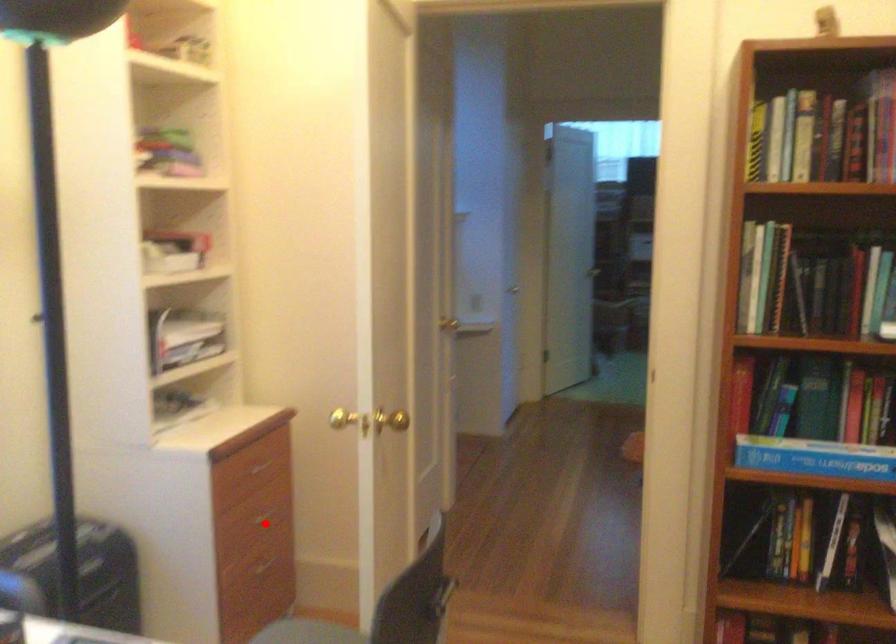
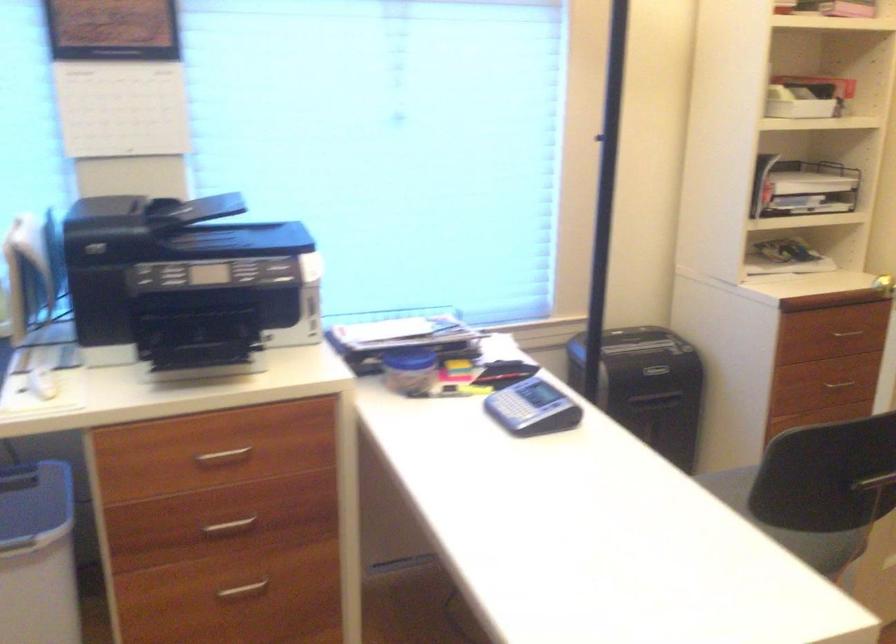
The point at the highlighted location is marked in the first image. Where is the corresponding point in the second image?

(838, 384)